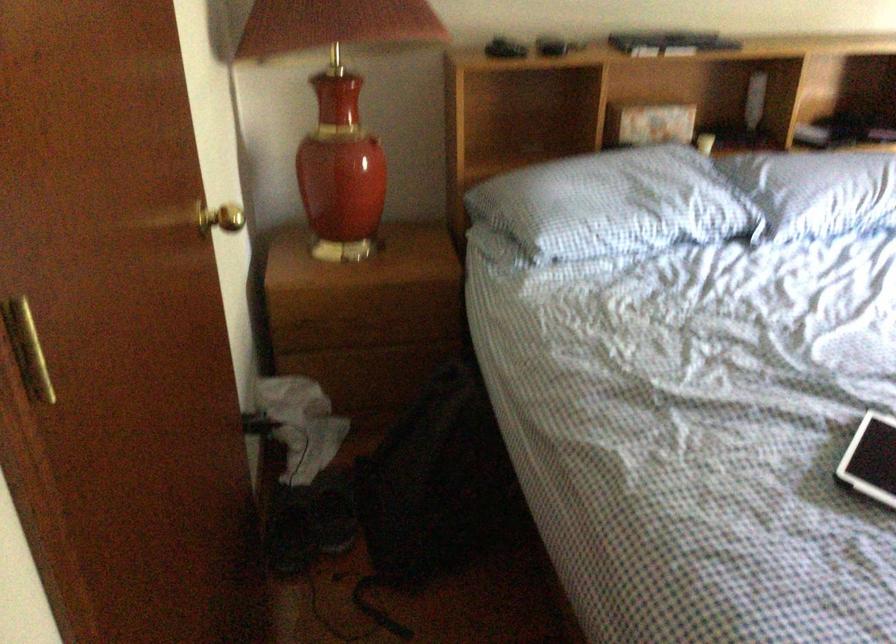
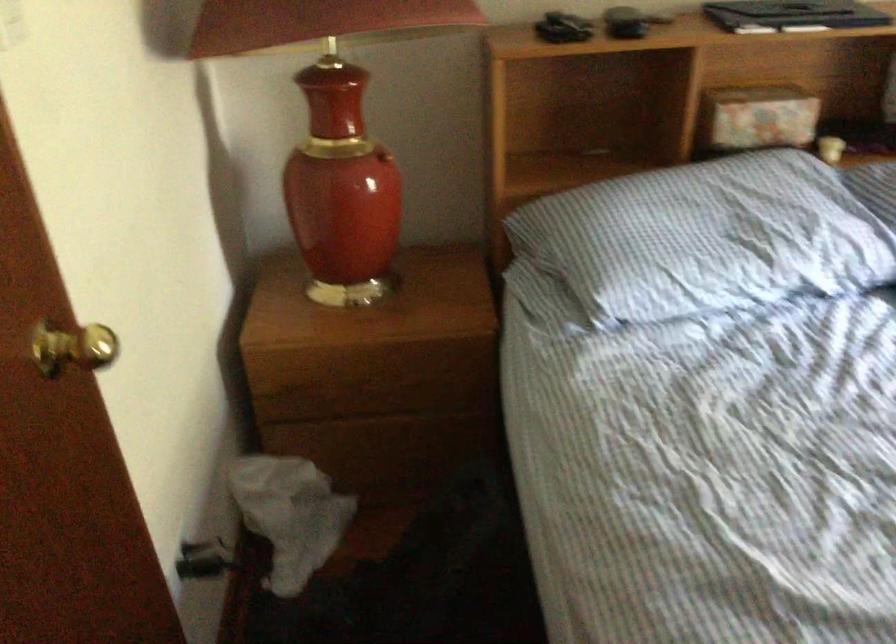
Question: In a continuous first-person perspective shot, in which direction is the camera moving?

Choices:
 (A) Left
 (B) Right
 (C) Forward
 (D) Backward

Answer: (C)